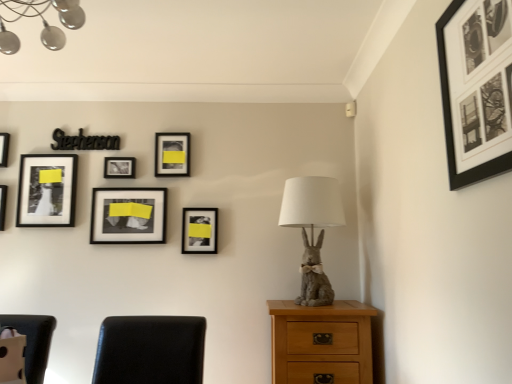
Question: Can you confirm if matte black picture frame at upper center, the 7th picture frame from the front, is positioned to the right of matte black picture frame at center, which appears as the 7th picture frame when viewed from the back?

Choices:
 (A) yes
 (B) no

Answer: (B)

Question: Is matte black picture frame at upper center, the 7th picture frame from the front, oriented away from matte black picture frame at center, the second picture frame in the front-to-back sequence?

Choices:
 (A) yes
 (B) no

Answer: (B)

Question: Is matte black picture frame at upper center, the 3th picture frame in the right-to-left sequence, positioned behind matte black picture frame at center, the second picture frame viewed from the right?

Choices:
 (A) no
 (B) yes

Answer: (B)

Question: Is matte black picture frame at upper center, the second picture frame positioned from the back, located outside matte black picture frame at center, the second picture frame in the front-to-back sequence?

Choices:
 (A) no
 (B) yes

Answer: (B)

Question: Is matte black picture frame at upper center, which is the sixth picture frame from left to right, beside matte black picture frame at center, the seventh picture frame positioned from the left?

Choices:
 (A) yes
 (B) no

Answer: (B)

Question: Looking at their shapes, would you say light oak wooden chest of drawers at lower right is wider or thinner than matte black picture frame at center, the fifth picture frame in the left-to-right sequence?

Choices:
 (A) wide
 (B) thin

Answer: (A)

Question: Choose the correct answer: Is light oak wooden chest of drawers at lower right inside matte black picture frame at center, which is the third picture frame in front-to-back order, or outside it?

Choices:
 (A) outside
 (B) inside

Answer: (A)

Question: From their relative heights in the image, would you say light oak wooden chest of drawers at lower right is taller or shorter than matte black picture frame at center, the sixth picture frame when ordered from back to front?

Choices:
 (A) tall
 (B) short

Answer: (A)

Question: From the image's perspective, relative to matte black picture frame at center, which is counted as the 4th picture frame, starting from the right, is light oak wooden chest of drawers at lower right above or below?

Choices:
 (A) above
 (B) below

Answer: (B)

Question: Is black matte picture frame at upper right, which ranks as the first picture frame in right-to-left order, inside or outside of matte black picture frame at center, the second picture frame viewed from the right?

Choices:
 (A) outside
 (B) inside

Answer: (A)

Question: Considering the positions of black matte picture frame at upper right, acting as the 8th picture frame starting from the left, and matte black picture frame at center, the second picture frame in the front-to-back sequence, in the image, is black matte picture frame at upper right, acting as the 8th picture frame starting from the left, wider or thinner than matte black picture frame at center, the second picture frame in the front-to-back sequence,?

Choices:
 (A) thin
 (B) wide

Answer: (A)

Question: Is black matte picture frame at upper right, which ranks as the first picture frame in right-to-left order, taller or shorter than matte black picture frame at center, which appears as the 7th picture frame when viewed from the back?

Choices:
 (A) tall
 (B) short

Answer: (A)

Question: In the image, is black matte picture frame at upper right, which is the eighth picture frame from back to front, positioned in front of or behind matte black picture frame at center, which appears as the 7th picture frame when viewed from the back?

Choices:
 (A) front
 (B) behind

Answer: (A)

Question: From a real-world perspective, is matte black picture frame at upper center, which is the sixth picture frame from left to right, physically located above or below gray fabric rabbit at center?

Choices:
 (A) above
 (B) below

Answer: (A)

Question: Considering their positions, is matte black picture frame at upper center, the second picture frame positioned from the back, located in front of or behind gray fabric rabbit at center?

Choices:
 (A) behind
 (B) front

Answer: (A)